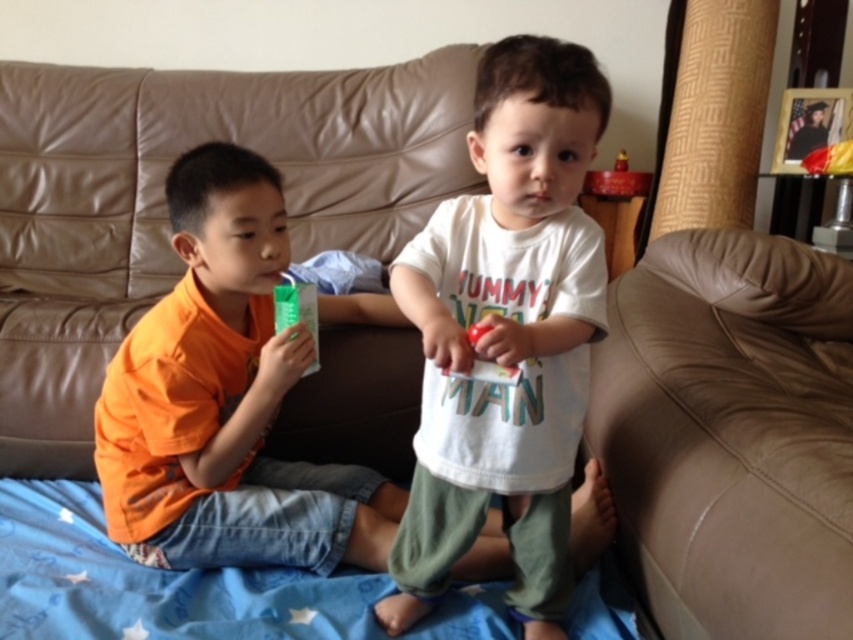
Question: Does white cotton shirt at center have a greater width compared to orange cotton shirt at left?

Choices:
 (A) no
 (B) yes

Answer: (A)

Question: Which point is farther to the camera?

Choices:
 (A) orange cotton shirt at left
 (B) white cotton shirt at center

Answer: (A)

Question: Which point is farther to the camera?

Choices:
 (A) [x=294, y=468]
 (B) [x=529, y=563]

Answer: (A)

Question: Which of the following is the closest to the observer?

Choices:
 (A) (254, 154)
 (B) (451, 488)

Answer: (B)

Question: Can you confirm if white cotton shirt at center is positioned below orange cotton shirt at left?

Choices:
 (A) no
 (B) yes

Answer: (A)

Question: Can you confirm if white cotton shirt at center is positioned to the right of orange cotton shirt at left?

Choices:
 (A) no
 (B) yes

Answer: (B)